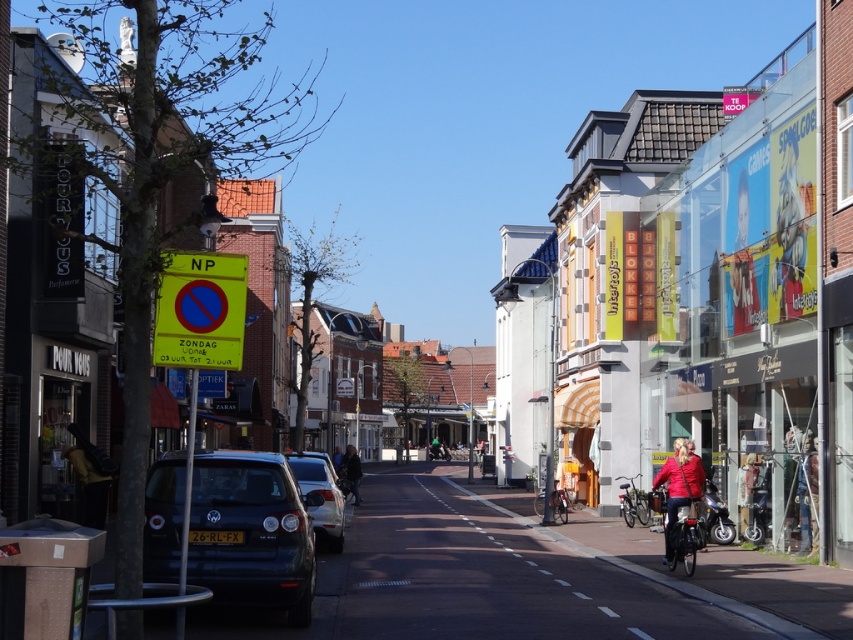
Question: Among these objects, which one is nearest to the camera?

Choices:
 (A) silver metallic bicycle at center-right
 (B) dark blue jacket at center

Answer: (A)

Question: Is the position of shiny black motorcycle at center-right less distant than that of silver metallic bicycle at center?

Choices:
 (A) no
 (B) yes

Answer: (B)

Question: Among these objects, which one is nearest to the camera?

Choices:
 (A) silver metallic car at center
 (B) silver metallic bicycle at center-right
 (C) red leather jacket at lower right
 (D) dark blue metallic car at lower left

Answer: (D)

Question: Which object is closer to the camera taking this photo?

Choices:
 (A) shiny black motorcycle at center-right
 (B) red leather jacket at lower right
 (C) silver metallic bicycle at center
 (D) silver metallic car at center

Answer: (B)

Question: Can you confirm if red leather jacket at lower right is thinner than silver metallic bicycle at center?

Choices:
 (A) yes
 (B) no

Answer: (A)

Question: Is silver metallic car at center wider than dark blue jacket at center?

Choices:
 (A) no
 (B) yes

Answer: (A)